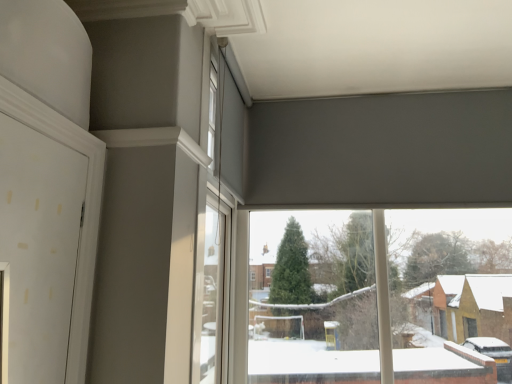
Question: Which direction should I rotate to face transparent glass window at center, acting as the 1th window starting from the right, — up or down?

Choices:
 (A) up
 (B) down

Answer: (B)

Question: From a real-world perspective, is white matte window at upper center, arranged as the 2th window when viewed from the right, below transparent glass window at center, marked as the second window in a top-to-bottom arrangement?

Choices:
 (A) yes
 (B) no

Answer: (B)

Question: Is white matte window at upper center, the 2th window from the bottom, wider than transparent glass window at center, the 1th window when ordered from bottom to top?

Choices:
 (A) no
 (B) yes

Answer: (A)

Question: From the image's perspective, would you say white matte window at upper center, the first window positioned from the top, is shown under transparent glass window at center, marked as the second window in a top-to-bottom arrangement?

Choices:
 (A) no
 (B) yes

Answer: (A)

Question: From the image's perspective, is white matte window at upper center, the first window positioned from the top, over transparent glass window at center, the 1th window when ordered from bottom to top?

Choices:
 (A) no
 (B) yes

Answer: (B)

Question: Does white matte window at upper center, the first window positioned from the top, have a larger size compared to transparent glass window at center, marked as the second window in a top-to-bottom arrangement?

Choices:
 (A) yes
 (B) no

Answer: (B)

Question: Is white matte window at upper center, the 2th window from the bottom, in front of transparent glass window at center, the 1th window when ordered from bottom to top?

Choices:
 (A) no
 (B) yes

Answer: (B)

Question: From a real-world perspective, is transparent glass window at center, which is counted as the second window, starting from the left, physically above white matte window at upper center, arranged as the 2th window when viewed from the right?

Choices:
 (A) no
 (B) yes

Answer: (A)

Question: Is transparent glass window at center, which is counted as the second window, starting from the left, oriented away from white matte window at upper center, the 2th window from the bottom?

Choices:
 (A) yes
 (B) no

Answer: (B)

Question: Is the surface of transparent glass window at center, acting as the 1th window starting from the right, in direct contact with white matte window at upper center, arranged as the 2th window when viewed from the right?

Choices:
 (A) no
 (B) yes

Answer: (A)

Question: Does transparent glass window at center, acting as the 1th window starting from the right, have a lesser width compared to white matte window at upper center, which ranks as the first window in left-to-right order?

Choices:
 (A) no
 (B) yes

Answer: (A)

Question: Is the position of transparent glass window at center, the 1th window when ordered from bottom to top, more distant than that of white matte window at upper center, the first window positioned from the top?

Choices:
 (A) yes
 (B) no

Answer: (A)

Question: Is transparent glass window at center, marked as the second window in a top-to-bottom arrangement, closer to camera compared to white matte window at upper center, arranged as the 2th window when viewed from the right?

Choices:
 (A) yes
 (B) no

Answer: (B)

Question: Considering the positions of transparent glass window at center, acting as the 1th window starting from the right, and white matte window at upper center, the first window positioned from the top, in the image, is transparent glass window at center, acting as the 1th window starting from the right, taller or shorter than white matte window at upper center, the first window positioned from the top,?

Choices:
 (A) short
 (B) tall

Answer: (B)